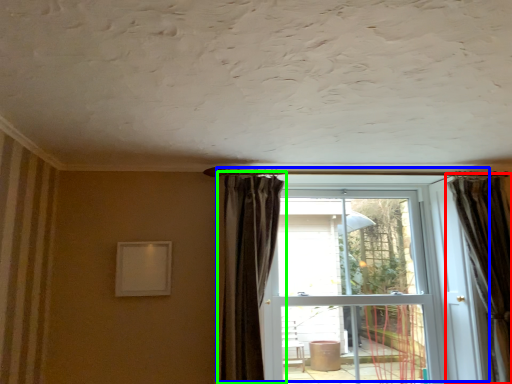
Question: Which is nearer to the curtain (highlighted by a red box)? door (highlighted by a blue box) or curtain (highlighted by a green box).

Choices:
 (A) door
 (B) curtain

Answer: (A)